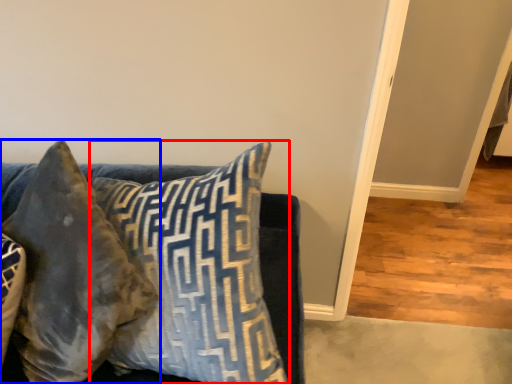
Question: Among these objects, which one is nearest to the camera, pillow (highlighted by a red box) or pillow (highlighted by a blue box)?

Choices:
 (A) pillow
 (B) pillow

Answer: (A)